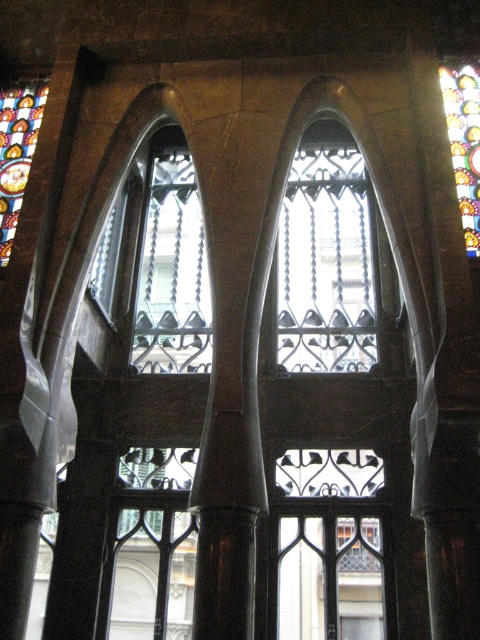
You are an architect designing a replica of this balcony. You need to ensure that the dark brown stone pillar at center and the clear glass window at center align properly. Which object should be placed first to ensure proper alignment based on their dimensions?

The dark brown stone pillar at center is thinner than the clear glass window at center, so you should place the clear glass window at center first to ensure proper alignment since it has a larger width and will serve as the reference point for positioning the thinner pillar.

You are standing at the entrance of the cathedral and want to take a photo of the dark brown stone pillar at center. If your camera has a maximum focus range of 100 feet, will you be able to capture it clearly?

The dark brown stone pillar at center is 129.04 feet away from the camera, which exceeds the maximum focus range of 100 feet. Therefore, you won